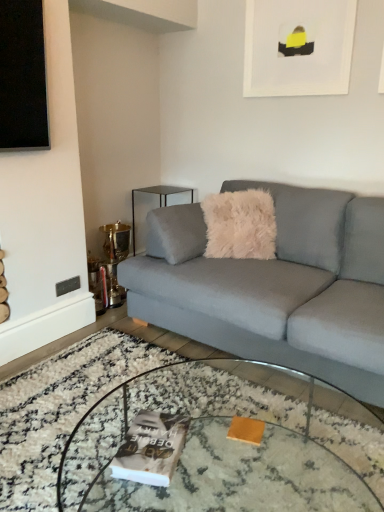
Locate an element on the screen. This screenshot has height=512, width=384. free space above clear glass coffee table at center (from a real-world perspective) is located at coordinates (213, 445).